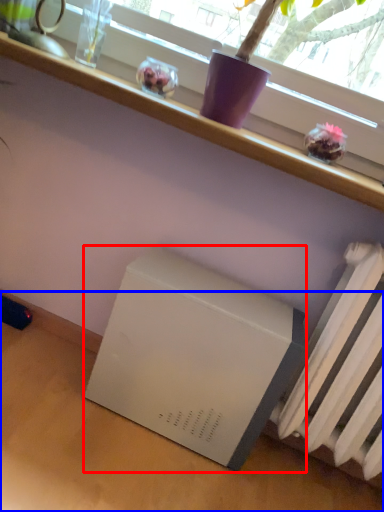
Question: Which object appears farthest to the camera in this image, appliance (highlighted by a red box) or table (highlighted by a blue box)?

Choices:
 (A) appliance
 (B) table

Answer: (A)